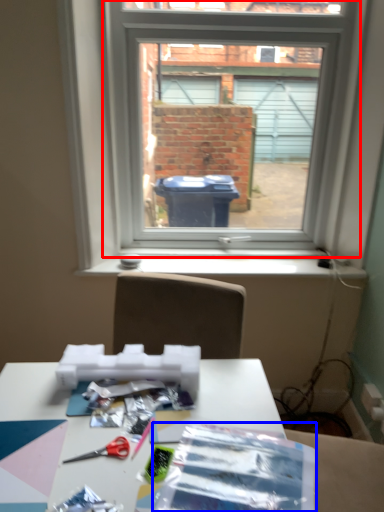
Question: Which of the following is the closest to the observer, window (highlighted by a red box) or wrapping paper (highlighted by a blue box)?

Choices:
 (A) window
 (B) wrapping paper

Answer: (B)